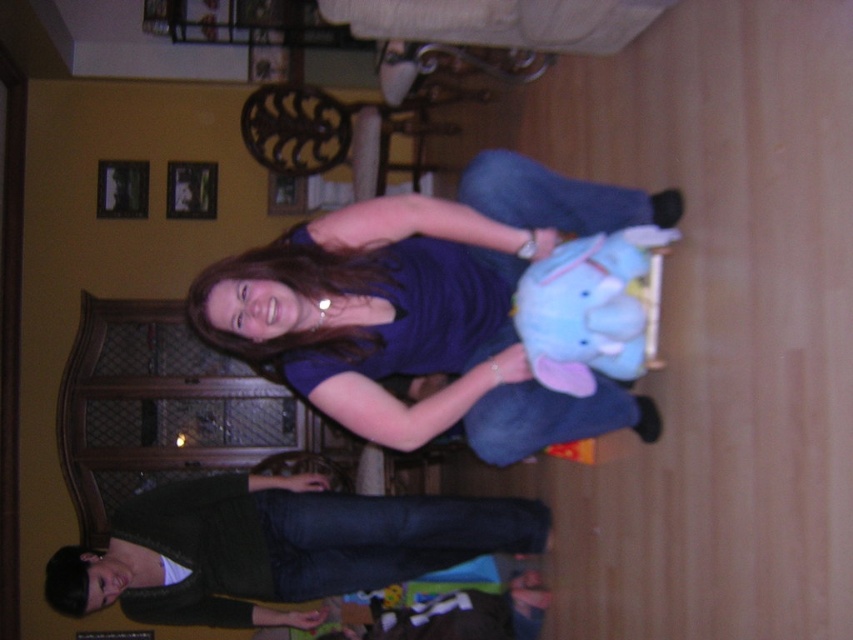
Does point (430, 220) lie in front of point (550, 253)?

Yes, it is in front of point (550, 253).

What do you see at coordinates (403, 326) in the screenshot? The image size is (853, 640). I see `matte blue dress at center` at bounding box center [403, 326].

Locate an element on the screen. The image size is (853, 640). matte blue dress at center is located at coordinates (403, 326).

Based on the photo, who is positioned more to the left, matte blue dress at center or dark blue jeans at lower center?

dark blue jeans at lower center is more to the left.

Does matte blue dress at center have a greater width compared to dark blue jeans at lower center?

Incorrect, matte blue dress at center's width does not surpass dark blue jeans at lower center's.

Measure the distance between point (257,248) and camera.

17.33 feet

The height and width of the screenshot is (640, 853). I want to click on matte blue dress at center, so 403,326.

Which of these two, dark blue jeans at lower center or soft blue plush elephant at center, stands shorter?

soft blue plush elephant at center is shorter.

Does dark blue jeans at lower center appear under soft blue plush elephant at center?

Yes, dark blue jeans at lower center is below soft blue plush elephant at center.

What are the coordinates of `dark blue jeans at lower center` in the screenshot? It's located at (276, 547).

Find the location of a particular element. The height and width of the screenshot is (640, 853). dark blue jeans at lower center is located at coordinates (276, 547).